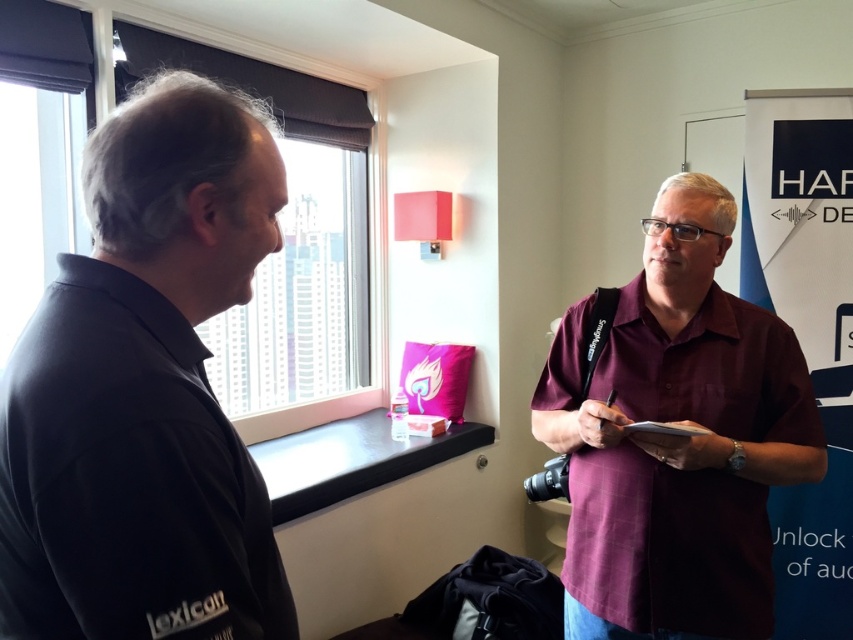
Question: Which of the following is the closest to the observer?

Choices:
 (A) (763, 490)
 (B) (4, 29)
 (C) (111, 588)

Answer: (C)

Question: Can you confirm if black matte shirt at left is thinner than dark matte window at upper left?

Choices:
 (A) no
 (B) yes

Answer: (B)

Question: Can you confirm if black matte shirt at left is positioned to the left of transparent glass window at upper left?

Choices:
 (A) no
 (B) yes

Answer: (A)

Question: Which point is farther to the camera?

Choices:
 (A) maroon plaid shirt at right
 (B) dark matte window at upper left
 (C) black matte shirt at left

Answer: (B)

Question: Which object is closer to the camera taking this photo?

Choices:
 (A) black matte shirt at left
 (B) maroon plaid shirt at right
 (C) dark matte window at upper left
 (D) transparent glass window at upper left

Answer: (A)

Question: Is maroon plaid shirt at right to the right of transparent glass window at upper left from the viewer's perspective?

Choices:
 (A) no
 (B) yes

Answer: (B)